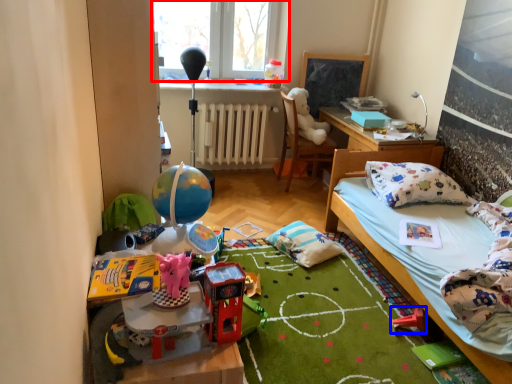
Question: Which point is further to the camera, window (highlighted by a red box) or toy (highlighted by a blue box)?

Choices:
 (A) window
 (B) toy

Answer: (A)